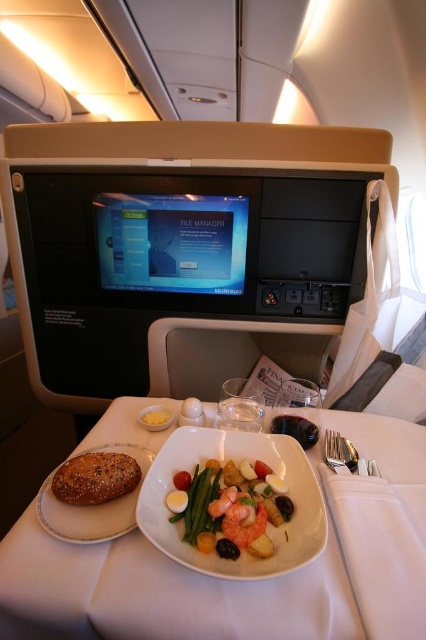
You are a flight attendant and need to place a napkin between the white matte plate at left and the yellow matte bread at left. Which object should you place the napkin closer to if you want it to be on the right side of the plate?

The white matte plate at left is positioned on the left side of the yellow matte bread at left. To place the napkin on the right side of the plate, you should place it closer to the yellow matte bread at left.

You are a flight attendant checking the table settings for passengers. You need to ensure that the white porcelain plate at center and the white matte plate at left are placed at the correct height for easy access. According to the airline guidelines, the taller plate should be positioned closer to the passenger. Which plate should be closer to the passenger?

The white porcelain plate at center is much taller than the white matte plate at left, so according to the airline guidelines, the white porcelain plate at center should be positioned closer to the passenger.

In the scene shown: You are seated in the airplane and want to reach both the point at coordinates point (104,516) and point (158,420) on the table. Which point is closer to you?

Point (104,516) is in front of point (158,420), so it is closer to you.